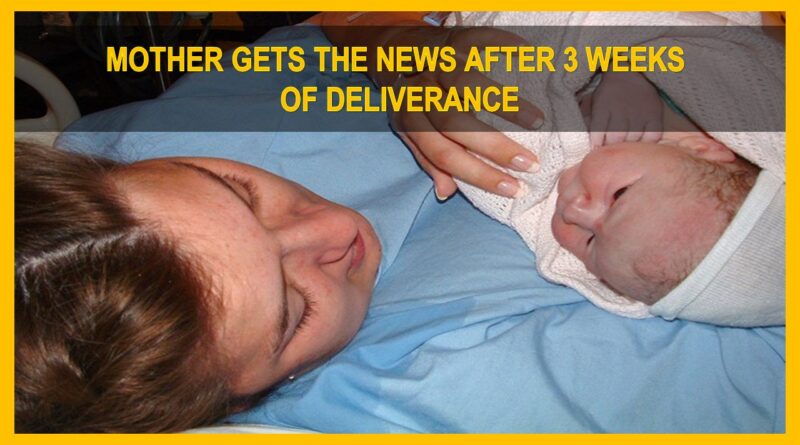
The image size is (800, 445). Find the location of `blanket`. blanket is located at coordinates (762, 138).